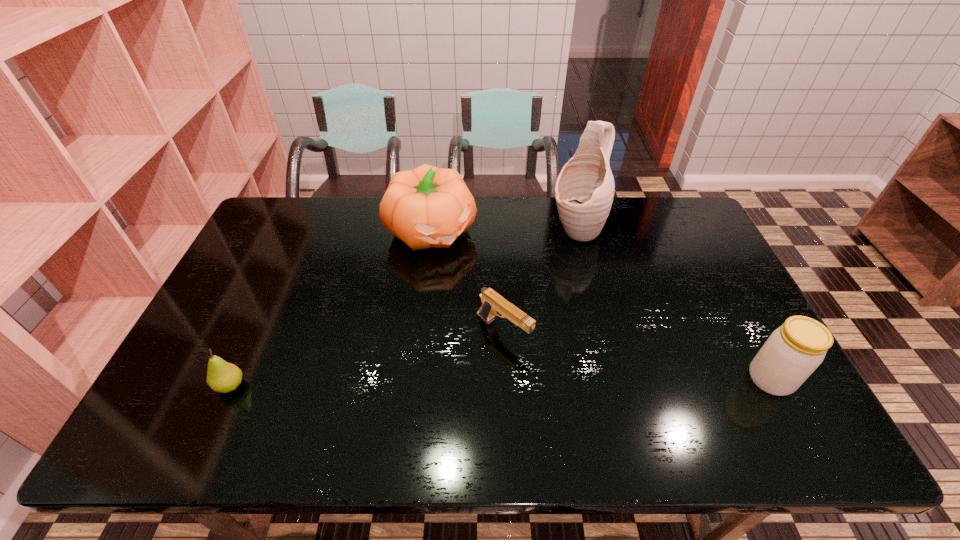
Locate an element on the screen. This screenshot has height=540, width=960. vacant spot on the desktop that is between the leftmost object and the jar and is positioned on the carved face of the fourth shortest object is located at coordinates (564, 381).

The height and width of the screenshot is (540, 960). What are the coordinates of `free spot on the desktop that is between the pear and the third shortest object and is positioned at the barrel of the third nearest object` in the screenshot? It's located at (567, 381).

Image resolution: width=960 pixels, height=540 pixels. In order to click on free space on the desktop that is between the pear and the rightmost object and is positioned at the spout of the pitcher in this screenshot , I will do `click(424, 383)`.